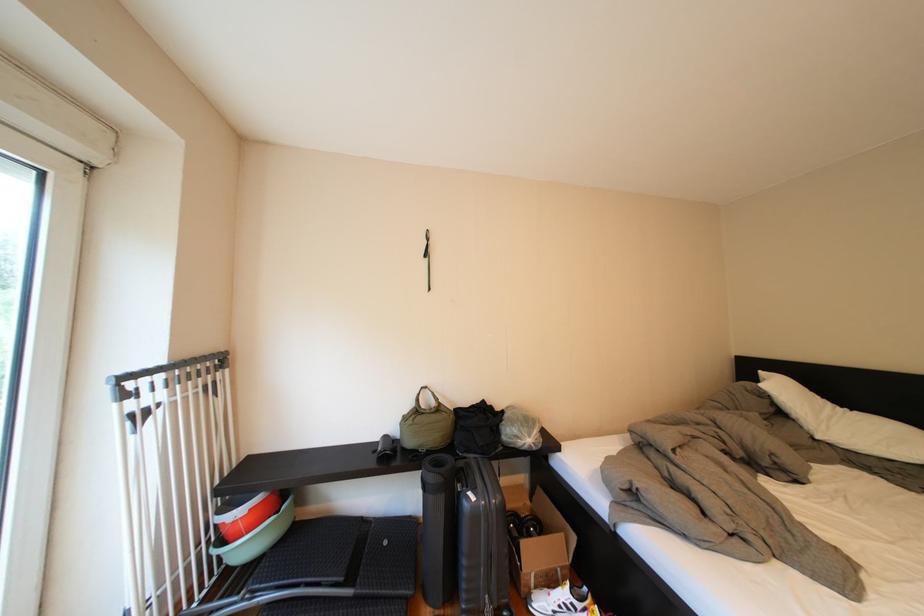
The location [256,537] corresponds to which object?

It corresponds to the green plastic basin in the image.